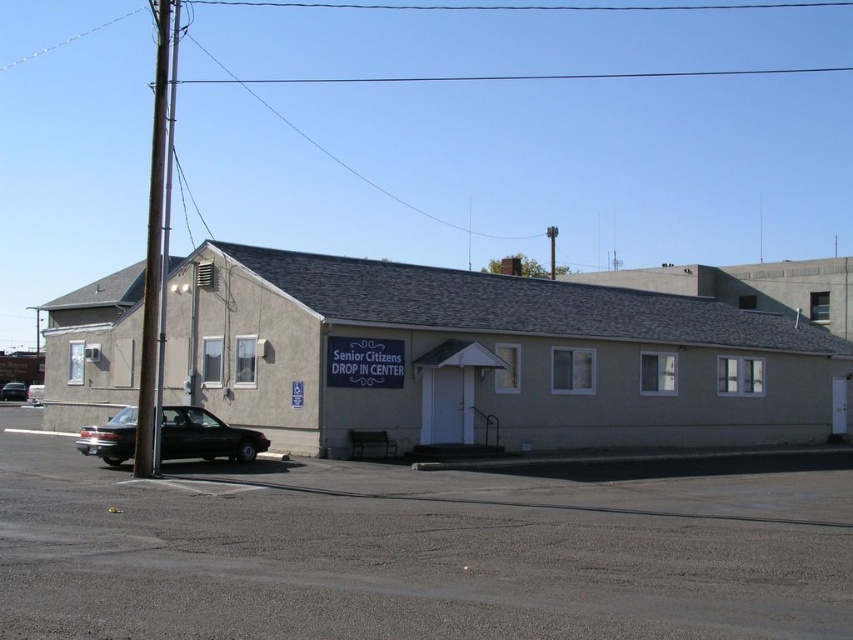
Does point (102, 576) lie behind point (213, 452)?

No, (102, 576) is closer to viewer.

In the scene shown: Can you confirm if gray asphalt parking lot at lower left is positioned to the left of shiny black sedan at lower left?

Incorrect, gray asphalt parking lot at lower left is not on the left side of shiny black sedan at lower left.

You are a GUI agent. You are given a task and a screenshot of the screen. Output one action in this format:
    pyautogui.click(x=<x>, y=<y>)
    Task: Click on the gray asphalt parking lot at lower left
    
    Given the screenshot: What is the action you would take?
    pyautogui.click(x=410, y=552)

Based on the photo, is the position of gray asphalt parking lot at lower left less distant than that of shiny black sedan at center?

Yes, it is.

Can you confirm if gray asphalt parking lot at lower left is positioned below shiny black sedan at center?

No, gray asphalt parking lot at lower left is not below shiny black sedan at center.

Who is more forward, (764, 497) or (6, 385)?

Point (764, 497) is in front.

At what (x,y) coordinates should I click in order to perform the action: click on gray asphalt parking lot at lower left. Please return your answer as a coordinate pair (x, y). This screenshot has width=853, height=640. Looking at the image, I should click on (410, 552).

Does shiny black sedan at lower left appear on the right side of shiny black sedan at center?

Indeed, shiny black sedan at lower left is positioned on the right side of shiny black sedan at center.

In the scene shown: Is shiny black sedan at lower left further to camera compared to shiny black sedan at center?

No, shiny black sedan at lower left is in front of shiny black sedan at center.

Between point (173, 404) and point (24, 396), which one is positioned behind?

The point (24, 396) is behind.

Where is `shiny black sedan at lower left`? The image size is (853, 640). shiny black sedan at lower left is located at coordinates (206, 436).